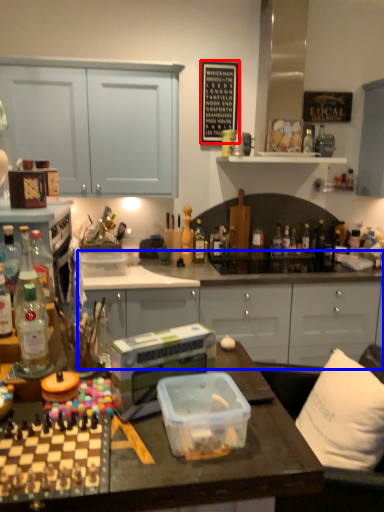
Question: Which object appears closest to the camera in this image, bulletin board (highlighted by a red box) or cabinetry (highlighted by a blue box)?

Choices:
 (A) bulletin board
 (B) cabinetry

Answer: (B)